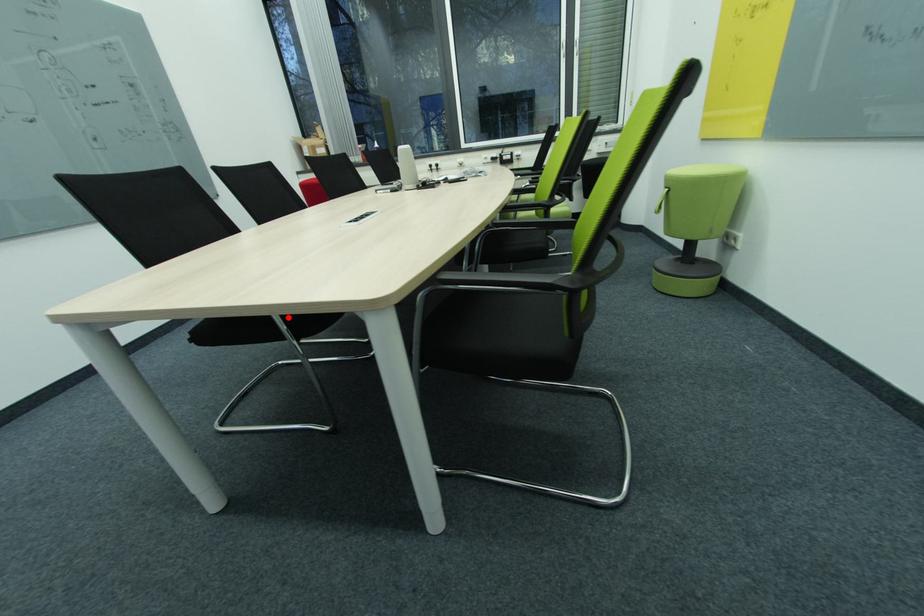
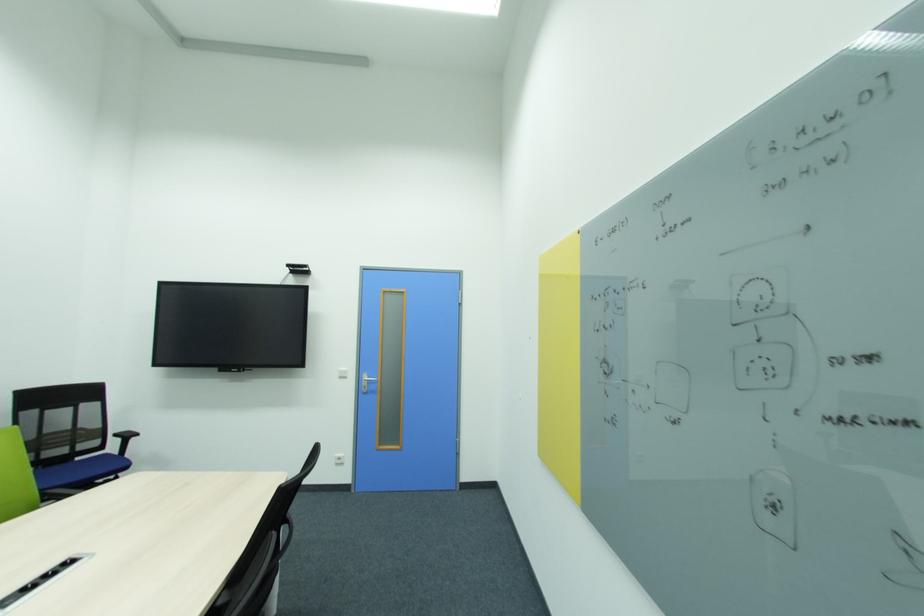
Question: I am providing you with two images of the same scene from different viewpoints. A red point is marked on the first image. Is the red point's position out of view in image 2?

Choices:
 (A) Yes
 (B) No

Answer: (A)